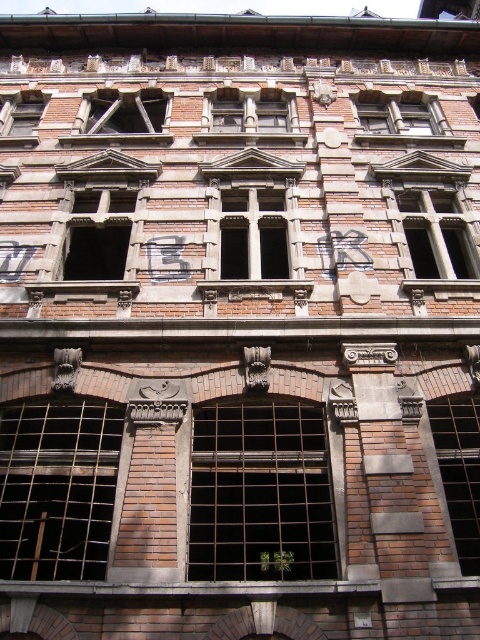
The width and height of the screenshot is (480, 640). Describe the element at coordinates (260, 493) in the screenshot. I see `rusty metal window at center` at that location.

Based on the photo, between rusty metal window at center and brown brick window at upper center, which one has more height?

rusty metal window at center is taller.

Looking at this image, who is more forward, (263, 486) or (392, 122)?

Point (263, 486) is in front.

Find the location of a particular element. rusty metal window at center is located at coordinates (260, 493).

Which is below, rusty metal bars at lower left or brick window at upper left?

rusty metal bars at lower left

From the picture: Can you confirm if rusty metal bars at lower left is positioned to the left of brick window at upper left?

Incorrect, rusty metal bars at lower left is not on the left side of brick window at upper left.

The width and height of the screenshot is (480, 640). What do you see at coordinates (58, 488) in the screenshot?
I see `rusty metal bars at lower left` at bounding box center [58, 488].

This screenshot has height=640, width=480. In order to click on rusty metal bars at lower left in this screenshot , I will do [x=58, y=488].

Between rusty metal window at center and rusty metal bars at lower left, which one has more height?

With more height is rusty metal bars at lower left.

Based on the photo, is rusty metal window at center below rusty metal bars at lower left?

Indeed, rusty metal window at center is positioned under rusty metal bars at lower left.

Who is more distant from viewer, (252, 529) or (104, 493)?

The point (104, 493) is behind.

You are a GUI agent. You are given a task and a screenshot of the screen. Output one action in this format:
    pyautogui.click(x=<x>, y=<y>)
    Task: Click on the rusty metal window at center
    The height and width of the screenshot is (640, 480).
    Given the screenshot: What is the action you would take?
    pyautogui.click(x=260, y=493)